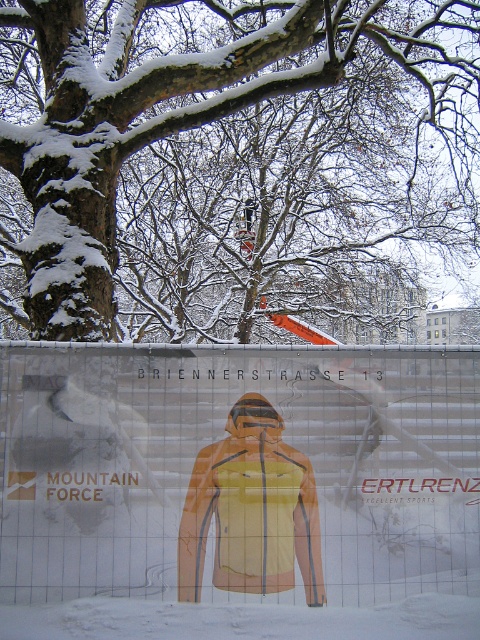
You are standing in front of the snowy advertisement board and want to locate two specific points marked on the board. The first point is at coordinate point(119, 333) and the second at point(289, 502). Which point is closer to your current position?

Point(119, 333) is closer to your current position because it is further to the viewer than point(289, 502).